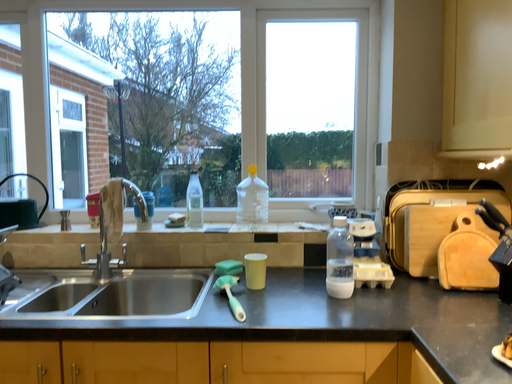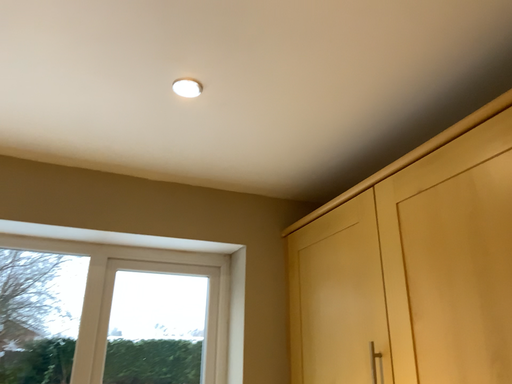
Question: Which way did the camera rotate in the video?

Choices:
 (A) rotated upward
 (B) rotated downward

Answer: (A)